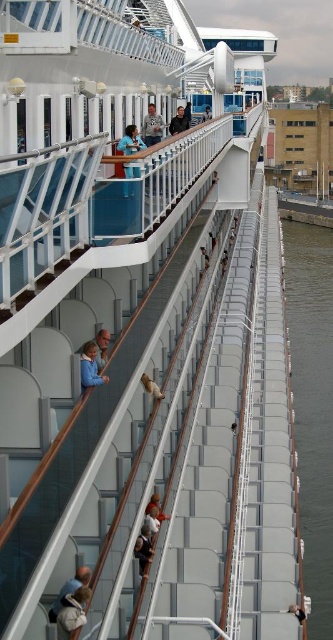
Question: Can you confirm if blue fabric shirt at upper center is thinner than black leather jacket at lower center?

Choices:
 (A) yes
 (B) no

Answer: (B)

Question: Which point is farther to the camera?

Choices:
 (A) (330, 588)
 (B) (293, 608)
 (C) (64, 589)
 (D) (134, 131)

Answer: (A)

Question: Is leather backpack at lower left to the right of light blue fabric jacket at upper center from the viewer's perspective?

Choices:
 (A) no
 (B) yes

Answer: (A)

Question: Which object is farther from the camera taking this photo?

Choices:
 (A) blue fabric shirt at upper center
 (B) light blue fabric jacket at upper center
 (C) light brown leather jacket at lower center

Answer: (B)

Question: Which point appears closest to the camera in this image?

Choices:
 (A) pos(56,634)
 (B) pos(178,125)
 (C) pos(324,371)

Answer: (A)

Question: Observing the image, what is the correct spatial positioning of leather backpack at lower left in reference to black leather jacket at lower center?

Choices:
 (A) left
 (B) right

Answer: (A)